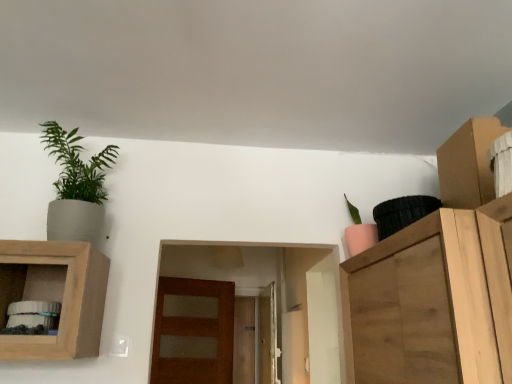
Question: Is brown matte door at center not near brown cardboard cabinet at upper right?

Choices:
 (A) yes
 (B) no

Answer: (A)

Question: Is the position of brown matte door at center less distant than that of brown cardboard cabinet at upper right?

Choices:
 (A) yes
 (B) no

Answer: (B)

Question: Does brown matte door at center appear on the left side of brown cardboard cabinet at upper right?

Choices:
 (A) no
 (B) yes

Answer: (B)

Question: From a real-world perspective, is brown matte door at center located beneath brown cardboard cabinet at upper right?

Choices:
 (A) yes
 (B) no

Answer: (A)

Question: Is brown matte door at center facing towards brown cardboard cabinet at upper right?

Choices:
 (A) yes
 (B) no

Answer: (A)

Question: Is brown cardboard cabinet at upper right inside or outside of matte gray pot at upper left, which appears as the 2th houseplant when viewed from the right?

Choices:
 (A) inside
 (B) outside

Answer: (B)

Question: From the image's perspective, relative to matte gray pot at upper left, arranged as the 1th houseplant when viewed from the left, is brown cardboard cabinet at upper right above or below?

Choices:
 (A) above
 (B) below

Answer: (A)

Question: Is brown cardboard cabinet at upper right to the left or to the right of matte gray pot at upper left, arranged as the 1th houseplant when viewed from the left, in the image?

Choices:
 (A) left
 (B) right

Answer: (B)

Question: In the image, is brown cardboard cabinet at upper right positioned in front of or behind matte gray pot at upper left, which appears as the 2th houseplant when viewed from the right?

Choices:
 (A) front
 (B) behind

Answer: (A)

Question: From their relative heights in the image, would you say brown cardboard cabinet at upper right is taller or shorter than wooden cabinet at left?

Choices:
 (A) tall
 (B) short

Answer: (B)

Question: From a real-world perspective, is brown cardboard cabinet at upper right above or below wooden cabinet at left?

Choices:
 (A) above
 (B) below

Answer: (A)

Question: Visually, is brown cardboard cabinet at upper right positioned to the left or to the right of wooden cabinet at left?

Choices:
 (A) left
 (B) right

Answer: (B)

Question: From the image's perspective, is brown cardboard cabinet at upper right positioned above or below wooden cabinet at left?

Choices:
 (A) above
 (B) below

Answer: (A)

Question: In terms of width, does pink matte pot at upper right, the first houseplant in the right-to-left sequence, look wider or thinner when compared to wooden cabinet at left?

Choices:
 (A) thin
 (B) wide

Answer: (A)

Question: From the image's perspective, is pink matte pot at upper right, positioned as the second houseplant in left-to-right order, positioned above or below wooden cabinet at left?

Choices:
 (A) above
 (B) below

Answer: (A)